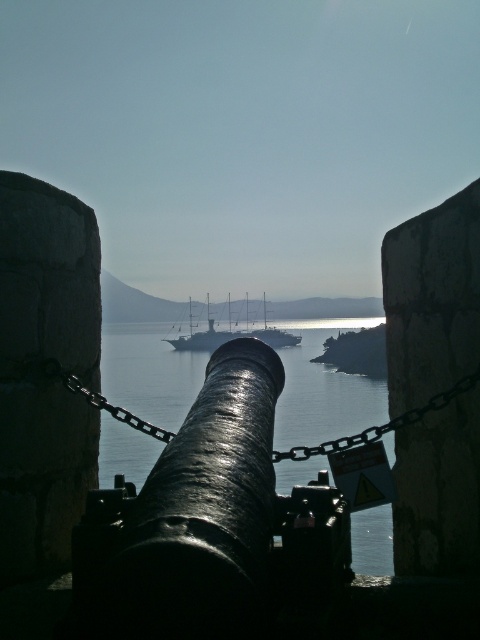
Which of these two, smooth blue water at center or black metal chain at center, stands taller?

smooth blue water at center

Is smooth blue water at center shorter than black metal chain at center?

In fact, smooth blue water at center may be taller than black metal chain at center.

Is point (113, 280) farther from camera compared to point (383, 428)?

Yes, it is.

Where is `smooth blue water at center`? smooth blue water at center is located at coordinates (136, 304).

Does smooth blue water at center appear on the right side of shiny silver ship at center?

No, smooth blue water at center is not to the right of shiny silver ship at center.

Is smooth blue water at center positioned before shiny silver ship at center?

No, smooth blue water at center is further to the viewer.

At what (x,y) coordinates should I click in order to perform the action: click on smooth blue water at center. Please return your answer as a coordinate pair (x, y). This screenshot has width=480, height=640. Looking at the image, I should click on (136, 304).

The height and width of the screenshot is (640, 480). What are the coordinates of `smooth blue water at center` in the screenshot? It's located at 136,304.

Is black metal chain at center positioned behind shiny silver ship at center?

No.

Image resolution: width=480 pixels, height=640 pixels. I want to click on black metal chain at center, so click(381, 424).